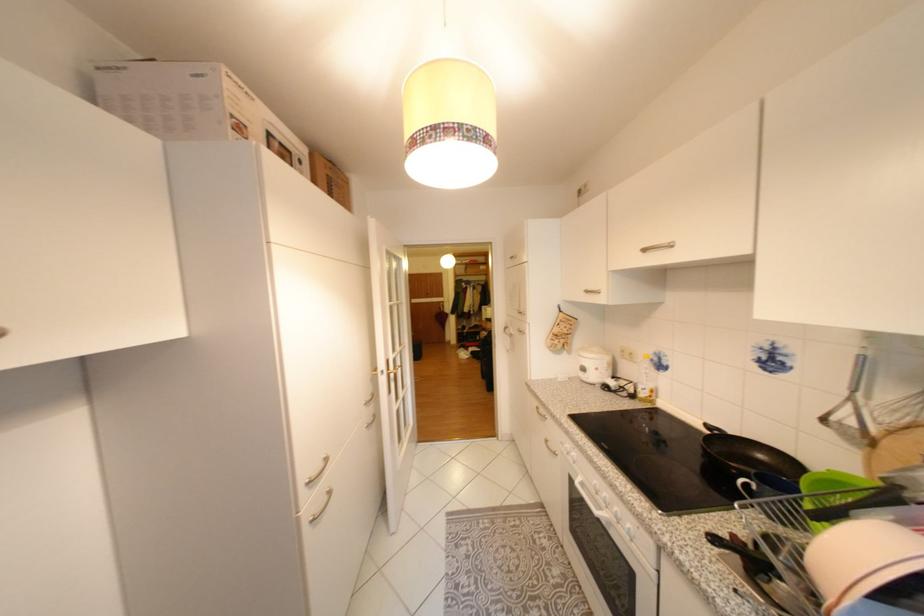
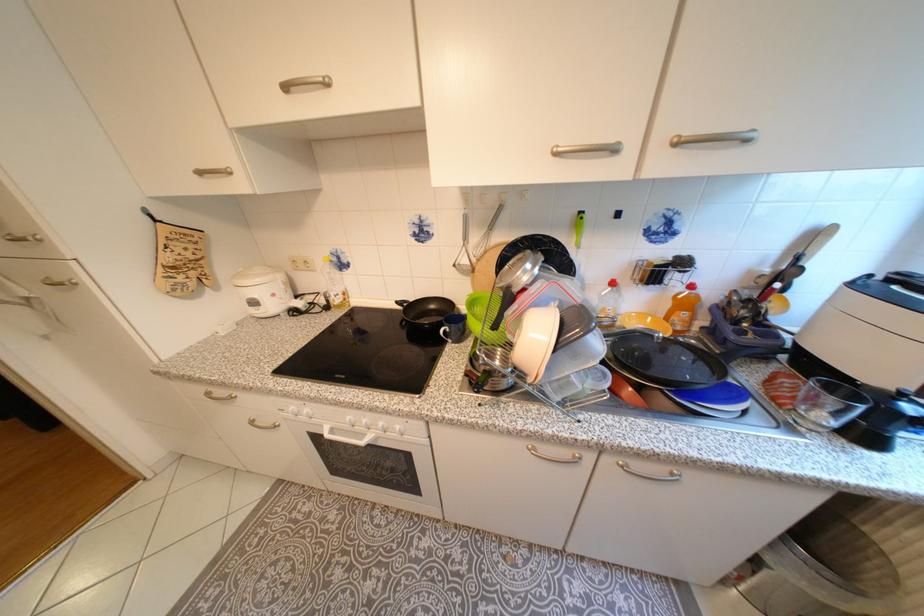
The point at [546,408] is marked in the first image. Where is the corresponding point in the second image?

(217, 394)